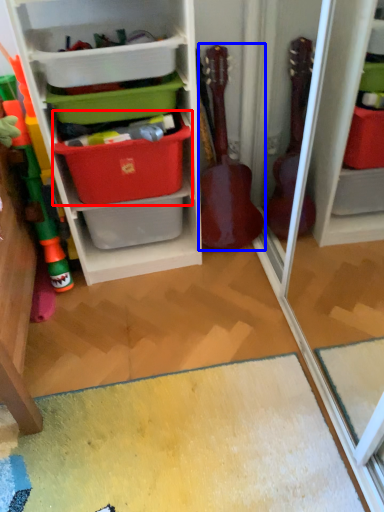
Question: Which object appears farthest to the camera in this image, storage box (highlighted by a red box) or guitar (highlighted by a blue box)?

Choices:
 (A) storage box
 (B) guitar

Answer: (B)